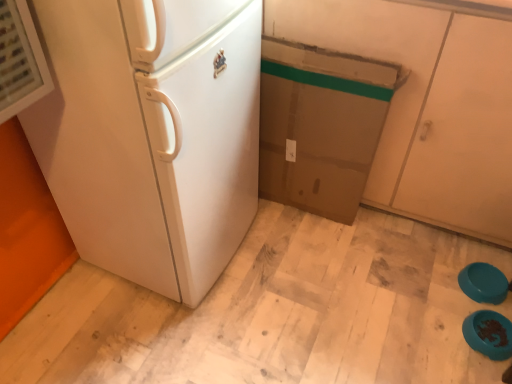
The width and height of the screenshot is (512, 384). I want to click on vacant area that is in front of white matte refrigerator at left, so click(156, 336).